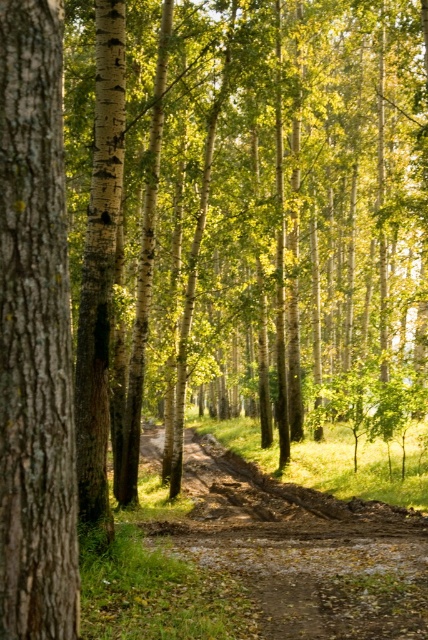
Does smooth brown bark at left have a greater height compared to brown muddy path at center?

Yes, smooth brown bark at left is taller than brown muddy path at center.

What do you see at coordinates (35, 333) in the screenshot? The width and height of the screenshot is (428, 640). I see `smooth brown bark at left` at bounding box center [35, 333].

What are the coordinates of `smooth brown bark at left` in the screenshot? It's located at (35, 333).